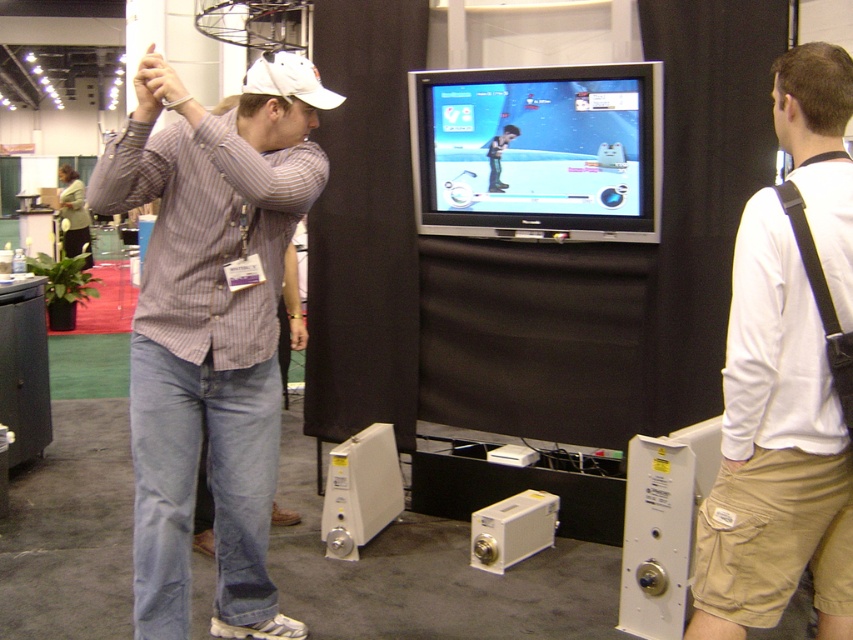
Question: Which of the following is the farthest from the observer?

Choices:
 (A) (796, 442)
 (B) (132, 534)

Answer: (B)

Question: Which of the following is the farthest from the observer?

Choices:
 (A) white cotton shirt at center
 (B) striped cotton shirt at center

Answer: (B)

Question: Can you confirm if striped cotton shirt at center is bigger than white cotton shirt at center?

Choices:
 (A) no
 (B) yes

Answer: (B)

Question: From the image, what is the correct spatial relationship of striped cotton shirt at center in relation to white cotton shirt at center?

Choices:
 (A) below
 (B) above

Answer: (A)

Question: Can you confirm if striped cotton shirt at center is positioned below white cotton shirt at center?

Choices:
 (A) yes
 (B) no

Answer: (A)